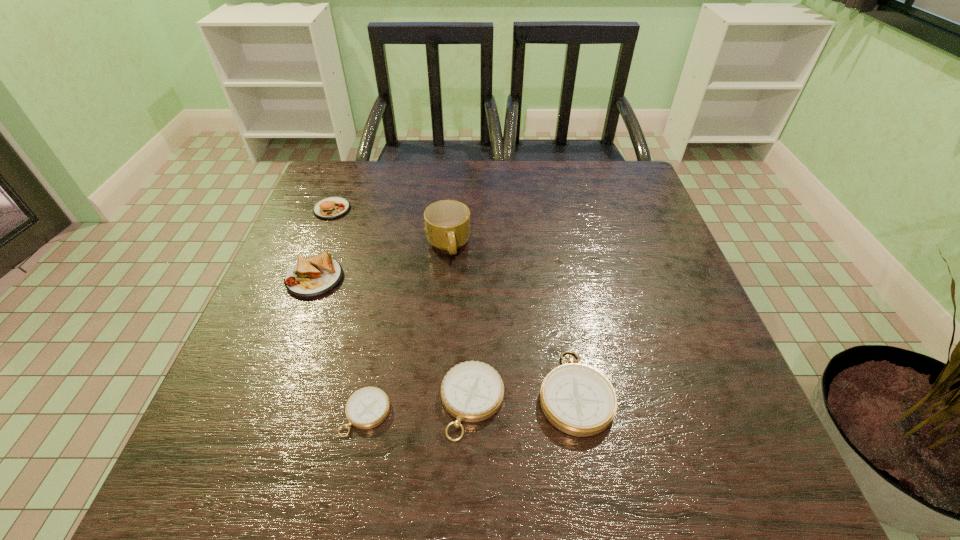
Locate an element on the screen. The width and height of the screenshot is (960, 540). the shortest object is located at coordinates (368, 407).

Where is `the shortest compass`? Image resolution: width=960 pixels, height=540 pixels. the shortest compass is located at coordinates (368, 407).

The width and height of the screenshot is (960, 540). I want to click on the second compass from left to right, so point(472,391).

Locate an element on the screen. The image size is (960, 540). the second shortest object is located at coordinates (472, 391).

You are a GUI agent. You are given a task and a screenshot of the screen. Output one action in this format:
    pyautogui.click(x=<x>, y=<y>)
    Task: Click on the rightmost object
    
    Given the screenshot: What is the action you would take?
    (579, 400)

The image size is (960, 540). Identify the location of the second tallest object. (334, 207).

Locate an element on the screen. The height and width of the screenshot is (540, 960). the farthest object is located at coordinates (334, 207).

The width and height of the screenshot is (960, 540). I want to click on the tallest object, so click(x=447, y=222).

Find the location of a particular element. The image size is (960, 540). sandwich is located at coordinates (317, 275).

You are a GUI agent. You are given a task and a screenshot of the screen. Output one action in this format:
    pyautogui.click(x=<x>, y=<y>)
    Task: Click on the vacant space located 0.380m on the back of the shortest object
    Image resolution: width=960 pixels, height=540 pixels.
    Given the screenshot: What is the action you would take?
    pyautogui.click(x=398, y=251)